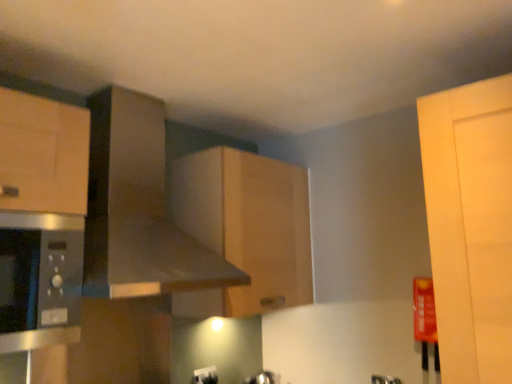
Question: From a real-world perspective, is metallic gray exhaust hood at upper center on white plastic electric outlet at lower center?

Choices:
 (A) yes
 (B) no

Answer: (A)

Question: Considering the relative sizes of metallic gray exhaust hood at upper center and white plastic electric outlet at lower center in the image provided, is metallic gray exhaust hood at upper center shorter than white plastic electric outlet at lower center?

Choices:
 (A) yes
 (B) no

Answer: (B)

Question: Is metallic gray exhaust hood at upper center looking in the opposite direction of white plastic electric outlet at lower center?

Choices:
 (A) yes
 (B) no

Answer: (B)

Question: Is metallic gray exhaust hood at upper center to the right of white plastic electric outlet at lower center from the viewer's perspective?

Choices:
 (A) no
 (B) yes

Answer: (A)

Question: Can you confirm if metallic gray exhaust hood at upper center is taller than white plastic electric outlet at lower center?

Choices:
 (A) no
 (B) yes

Answer: (B)

Question: Does metallic gray exhaust hood at upper center come behind white plastic electric outlet at lower center?

Choices:
 (A) no
 (B) yes

Answer: (A)

Question: Is white plastic electric outlet at lower center smaller than satin silver microwave at left?

Choices:
 (A) no
 (B) yes

Answer: (B)

Question: Can you confirm if white plastic electric outlet at lower center is taller than satin silver microwave at left?

Choices:
 (A) no
 (B) yes

Answer: (A)

Question: From a real-world perspective, is white plastic electric outlet at lower center below satin silver microwave at left?

Choices:
 (A) no
 (B) yes

Answer: (B)

Question: Can you confirm if white plastic electric outlet at lower center is bigger than satin silver microwave at left?

Choices:
 (A) yes
 (B) no

Answer: (B)

Question: Is white plastic electric outlet at lower center not near satin silver microwave at left?

Choices:
 (A) yes
 (B) no

Answer: (A)

Question: Is white plastic electric outlet at lower center turned away from satin silver microwave at left?

Choices:
 (A) no
 (B) yes

Answer: (A)

Question: Does wooden cabinet at center have a lesser width compared to white plastic electric outlet at lower center?

Choices:
 (A) yes
 (B) no

Answer: (B)